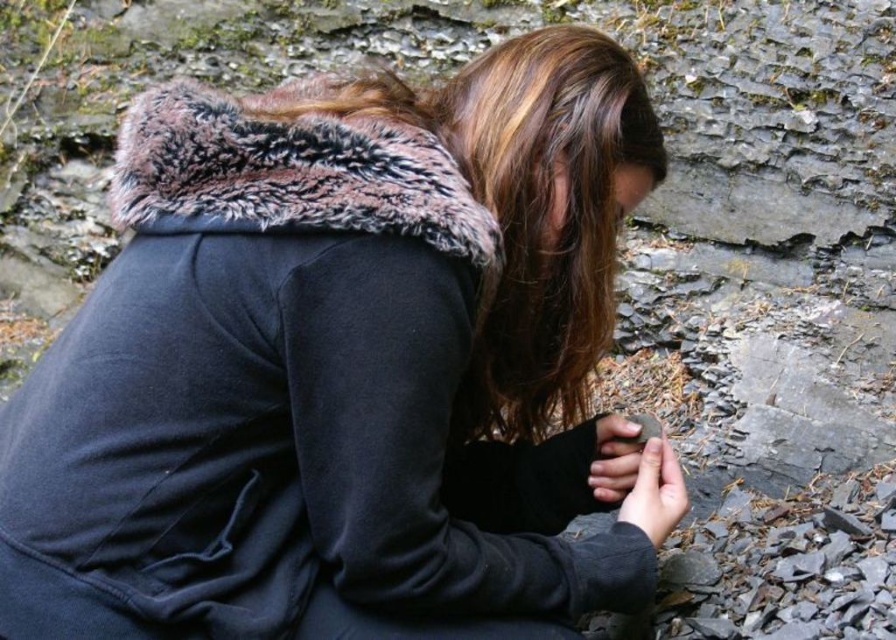
You are a hiker who needs to place both the black fleece jacket at center and the smooth gray stone at lower center into your backpack. The backpack has a compartment that can only fit items narrower than the other. Which item should you place first to ensure both fit?

The smooth gray stone at lower center is narrower than the black fleece jacket at center, so you should place the black fleece jacket at center first to make space for the narrower smooth gray stone at lower center.

You are a geologist examining two stones on the ground. You see the smooth brown stone at lower center and the smooth gray stone at lower center. Which stone is closer to the ground?

The smooth brown stone at lower center is located below the smooth gray stone at lower center, so the smooth brown stone at lower center is closer to the ground.

You are a geologist analyzing the image of a rocky area. You need to locate the smooth brown stone at lower center. What is its exact 2D coordinate in the image?

The smooth brown stone at lower center is located at the 2D coordinate point of (655, 492).